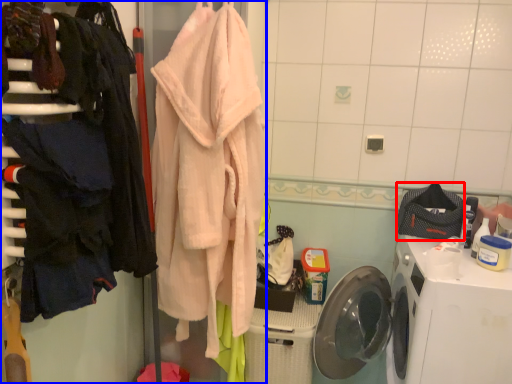
Question: Which of the following is the closest to the observer, clothing (highlighted by a red box) or closet (highlighted by a blue box)?

Choices:
 (A) clothing
 (B) closet

Answer: (B)